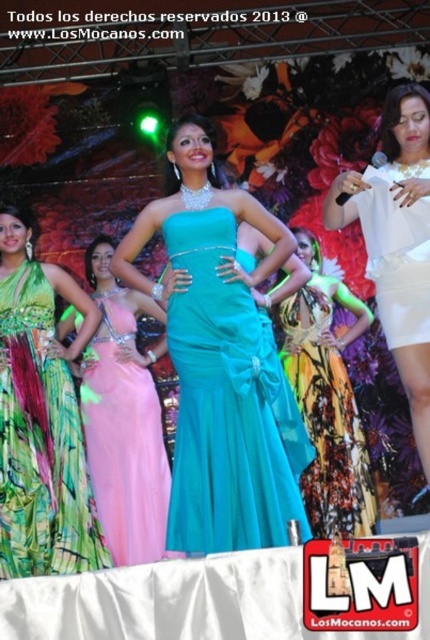
Question: Which object is the closest to the printed silk dress at center?

Choices:
 (A) green sequined dress at left
 (B) teal satin dress at center

Answer: (B)

Question: Based on their relative distances, which object is nearer to the white satin dress at right?

Choices:
 (A) printed silk dress at center
 (B) teal satin dress at center

Answer: (B)

Question: Considering the real-world distances, which object is closest to the printed silk dress at center?

Choices:
 (A) pink satin dress at center
 (B) white satin dress at center

Answer: (A)

Question: Does teal satin dress at center have a lesser width compared to green sequined dress at left?

Choices:
 (A) no
 (B) yes

Answer: (A)

Question: Does printed silk dress at center appear under white satin dress at center?

Choices:
 (A) yes
 (B) no

Answer: (A)

Question: Does teal satin dress at center have a lesser width compared to green sequined dress at left?

Choices:
 (A) yes
 (B) no

Answer: (B)